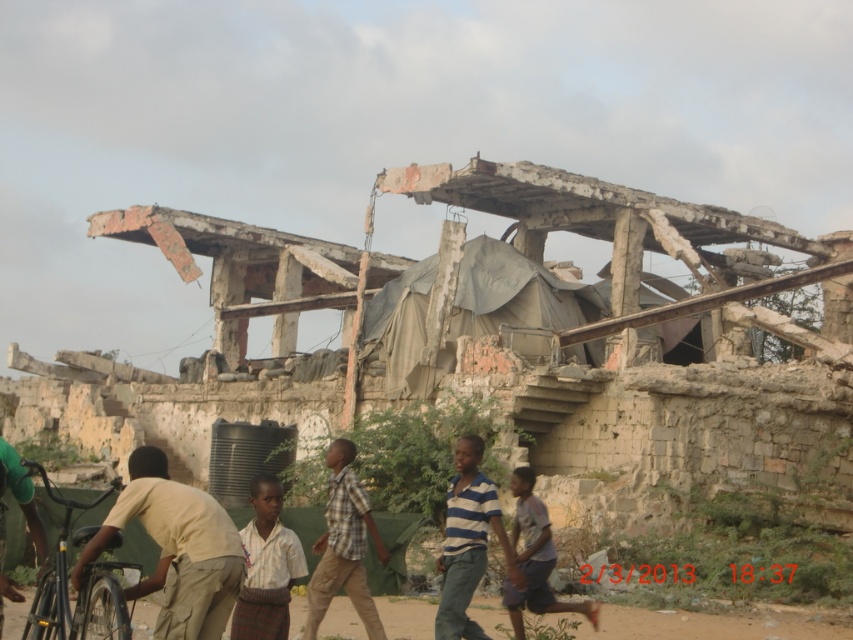
You are a GUI agent. You are given a task and a screenshot of the screen. Output one action in this format:
    pyautogui.click(x=<x>, y=<y>)
    Task: Click on the light beige fabric shirt at lower left
    
    Given the screenshot: What is the action you would take?
    pyautogui.click(x=177, y=548)

In the scene shown: How much distance is there between light beige fabric shirt at lower left and light brown plaid shirt at center?

light beige fabric shirt at lower left is 4.36 meters away from light brown plaid shirt at center.

Does point (167, 515) come behind point (260, 616)?

No, it is in front of (260, 616).

Locate an element on the screen. This screenshot has height=640, width=853. light beige fabric shirt at lower left is located at coordinates tap(177, 548).

Consider the image. Can you confirm if plaid shirt at center is taller than striped cotton shirt at center?

Indeed, plaid shirt at center has a greater height compared to striped cotton shirt at center.

Is point (363, 493) behind point (519, 595)?

Yes, point (363, 493) is farther from viewer.

What do you see at coordinates (343, 545) in the screenshot? The height and width of the screenshot is (640, 853). I see `plaid shirt at center` at bounding box center [343, 545].

You are a GUI agent. You are given a task and a screenshot of the screen. Output one action in this format:
    pyautogui.click(x=<x>, y=<y>)
    Task: Click on the plaid shirt at center
    The height and width of the screenshot is (640, 853).
    Given the screenshot: What is the action you would take?
    pyautogui.click(x=343, y=545)

Is light beige fabric shirt at lower left to the left of striped fabric shirt at center from the viewer's perspective?

Correct, you'll find light beige fabric shirt at lower left to the left of striped fabric shirt at center.

Which is in front, point (233, 570) or point (456, 604)?

Point (233, 570) is in front.

Does point (164, 570) come in front of point (457, 545)?

Yes, it is.

At what (x,y) coordinates should I click in order to perform the action: click on light beige fabric shirt at lower left. Please return your answer as a coordinate pair (x, y). The image size is (853, 640). Looking at the image, I should click on (177, 548).